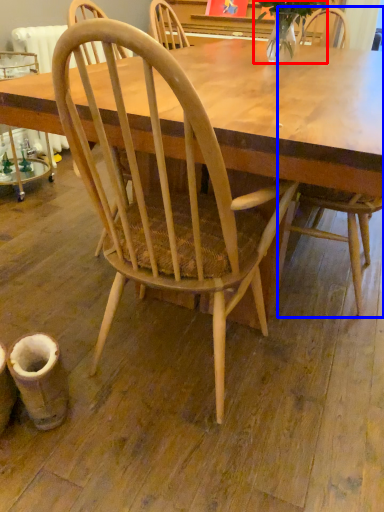
Question: Which object is further to the camera taking this photo, plant (highlighted by a red box) or chair (highlighted by a blue box)?

Choices:
 (A) plant
 (B) chair

Answer: (A)